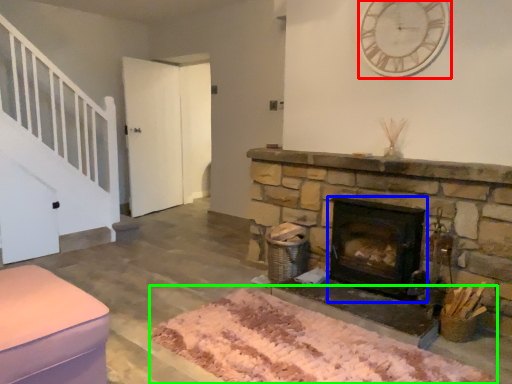
Question: Considering the real-world distances, which object is farthest from clock (highlighted by a red box)? wood burning stove (highlighted by a blue box) or mat (highlighted by a green box)?

Choices:
 (A) wood burning stove
 (B) mat

Answer: (B)